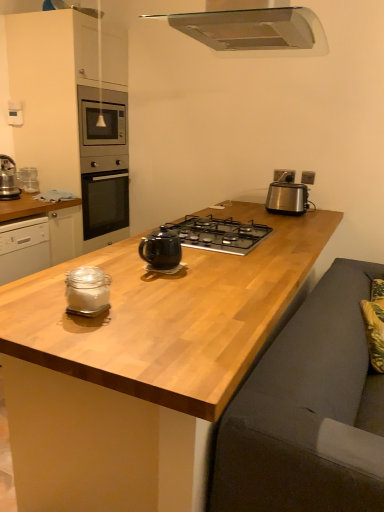
Image resolution: width=384 pixels, height=512 pixels. Find the location of `vacant space positioned to the left of clear glass jar at center`. vacant space positioned to the left of clear glass jar at center is located at coordinates (33, 305).